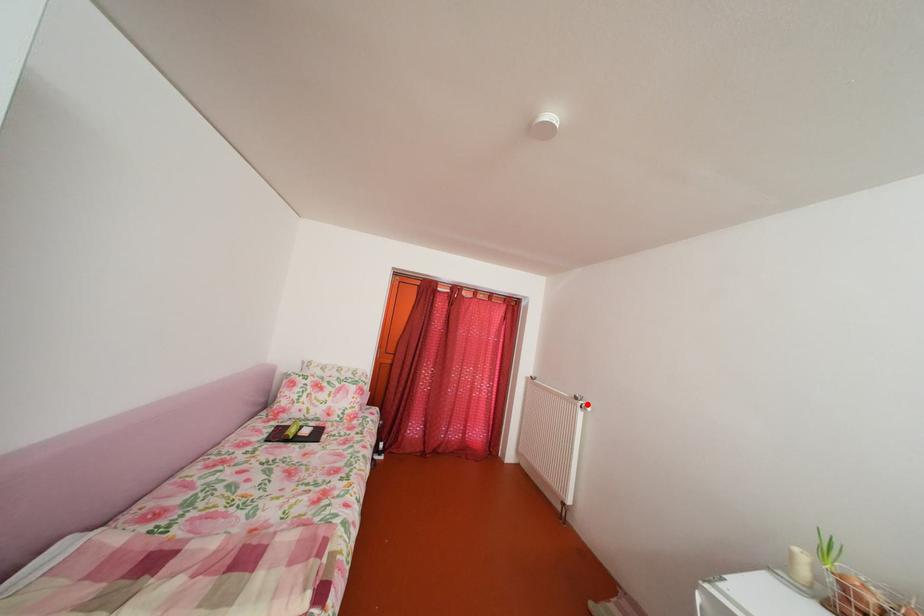
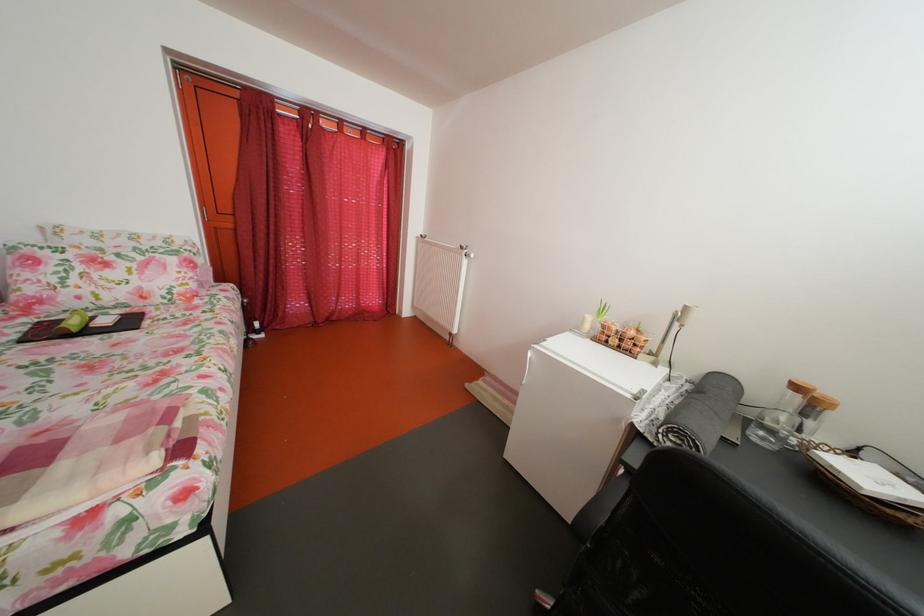
Where in the second image is the point corresponding to the highlighted location from the first image?

(473, 254)